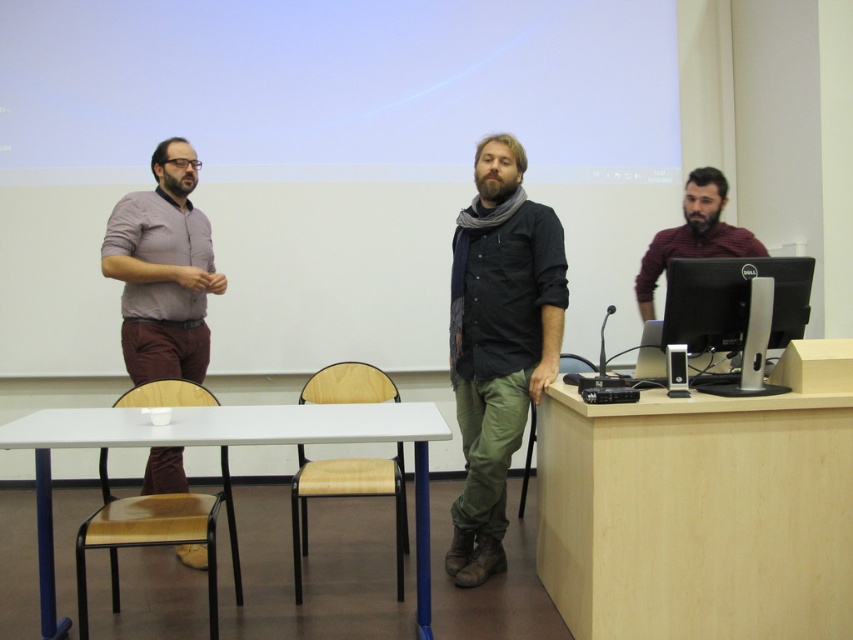
Question: Does white plastic table at center have a greater width compared to black glossy monitor at right?

Choices:
 (A) no
 (B) yes

Answer: (B)

Question: Is light brown wood table at right thinner than wooden chair at right?

Choices:
 (A) yes
 (B) no

Answer: (B)

Question: Estimate the real-world distances between objects in this image. Which object is closer to the wooden at left?

Choices:
 (A) white matte projection screen at upper center
 (B) white plastic table at center
 (C) wooden at right

Answer: (B)

Question: Which point is closer to the camera taking this photo?

Choices:
 (A) (311, 467)
 (B) (36, 433)
 (C) (706, 253)

Answer: (B)

Question: Estimate the real-world distances between objects in this image. Which object is closer to the dark gray scarf at center?

Choices:
 (A) light brown fabric chair at center
 (B) wooden at left

Answer: (A)

Question: Does wooden at left have a larger size compared to wooden at right?

Choices:
 (A) yes
 (B) no

Answer: (A)